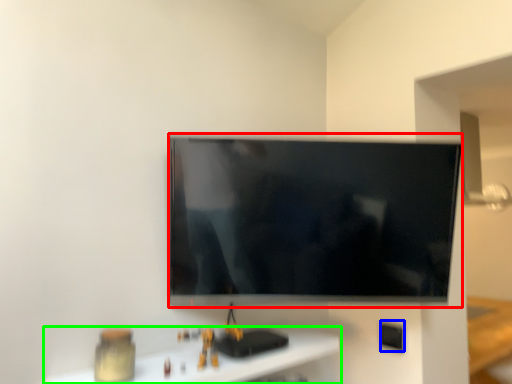
Question: Estimate the real-world distances between objects in this image. Which object is farther from television (highlighted by a red box), electric outlet (highlighted by a blue box) or furniture (highlighted by a green box)?

Choices:
 (A) electric outlet
 (B) furniture

Answer: (A)